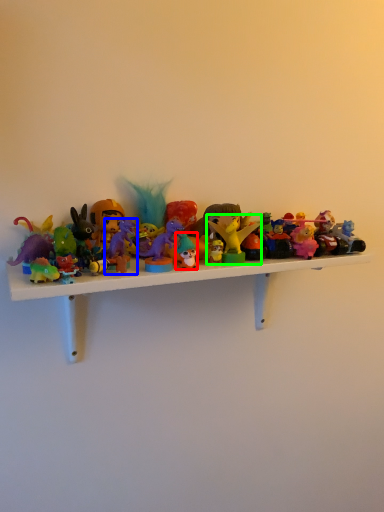
Question: Estimate the real-world distances between objects in this image. Which object is farther from toy (highlighted by a red box), toy (highlighted by a blue box) or toy (highlighted by a green box)?

Choices:
 (A) toy
 (B) toy

Answer: (A)